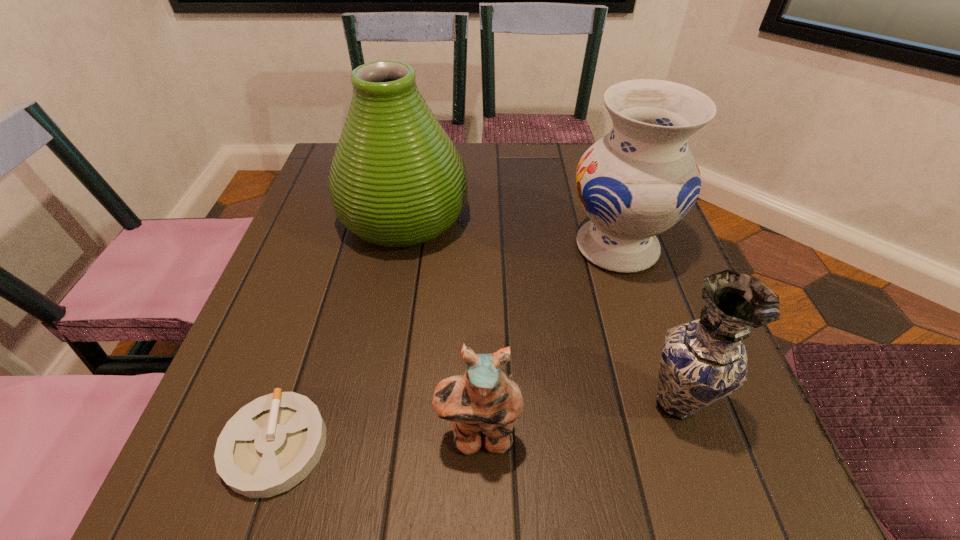
Identify the location of vase object that ranks as the closest to the figurine. This screenshot has height=540, width=960. (702, 361).